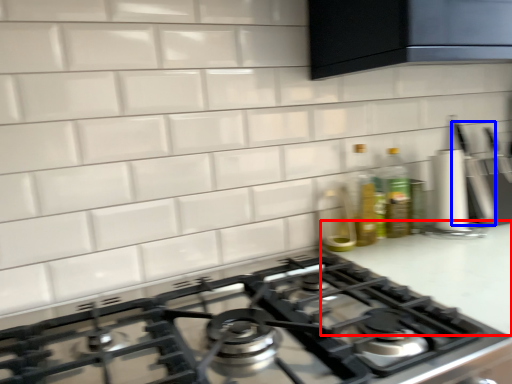
Question: Which point is further to the camera, counter top (highlighted by a red box) or kitchen appliance (highlighted by a blue box)?

Choices:
 (A) counter top
 (B) kitchen appliance

Answer: (B)